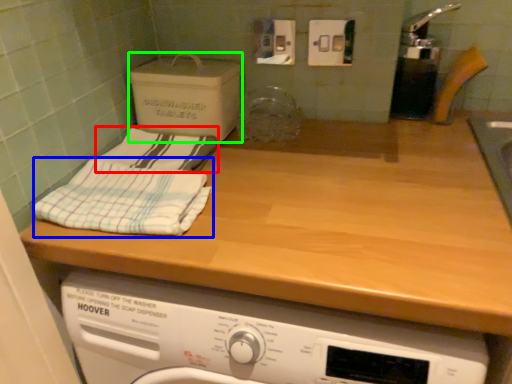
Question: Which object is the closest to the bath towel (highlighted by a red box)? Choose among these: bath towel (highlighted by a blue box) or cardboard box (highlighted by a green box).

Choices:
 (A) bath towel
 (B) cardboard box

Answer: (B)